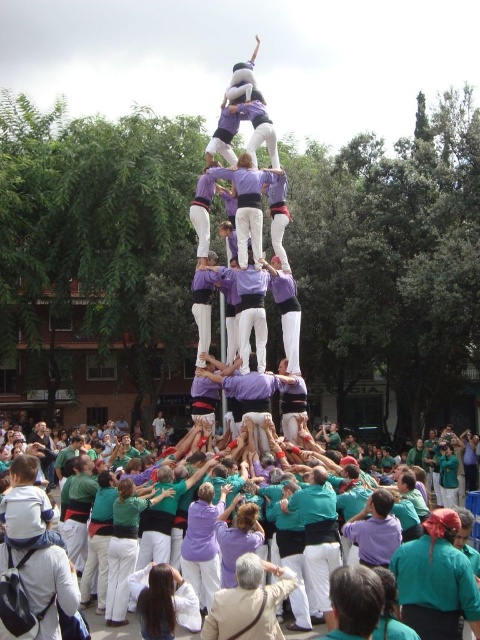
You are a photographer standing in the public square and want to capture a photo of the teal fabric shirt at center and the purple fabric crowd at lower left. Which object is higher in the image?

The teal fabric shirt at center is positioned over the purple fabric crowd at lower left, so it is higher in the image.